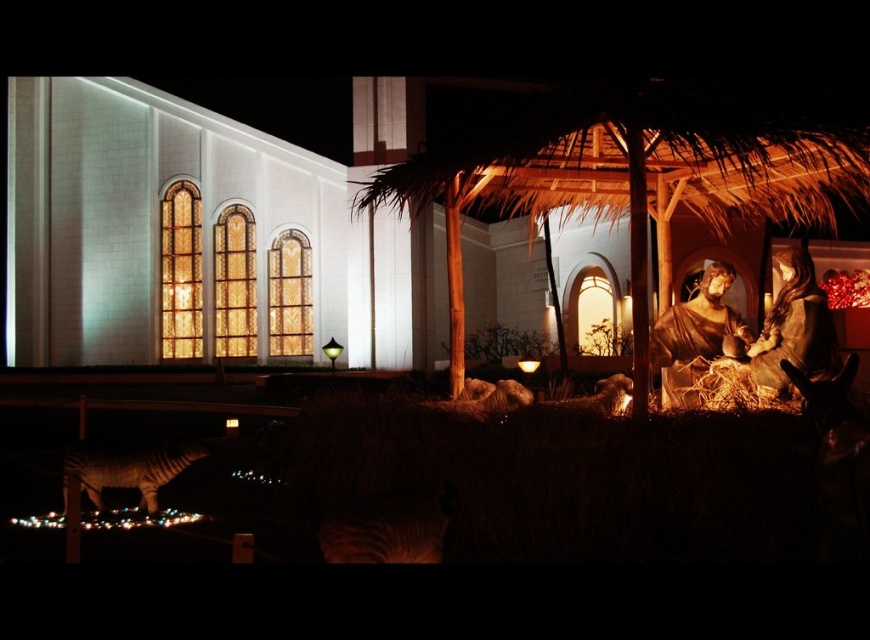
Can you confirm if white stone church at center is positioned to the right of striped fur tiger at lower left?

Incorrect, white stone church at center is not on the right side of striped fur tiger at lower left.

Who is higher up, white stone church at center or striped fur tiger at lower left?

Positioned higher is white stone church at center.

Who is more distant from viewer, (235, 198) or (202, 454)?

Positioned behind is point (235, 198).

Where is `white stone church at center`? white stone church at center is located at coordinates (191, 237).